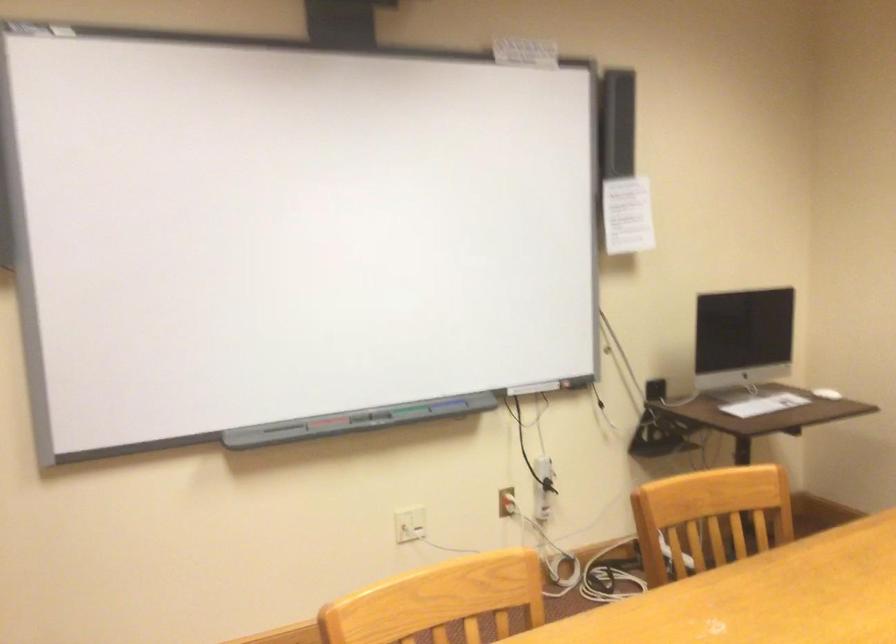
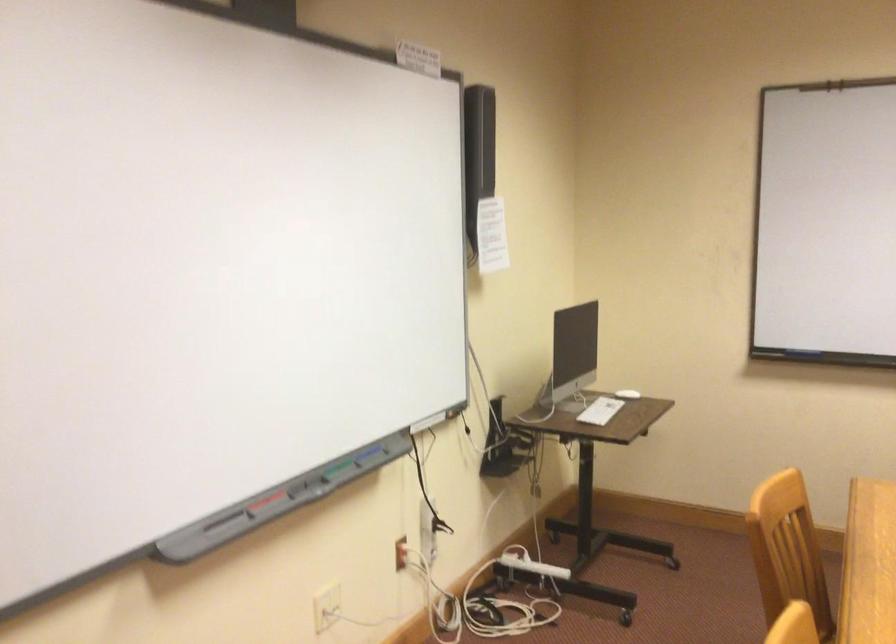
Locate, in the second image, the point that corresponds to pixel 411 410 in the first image.

(333, 468)